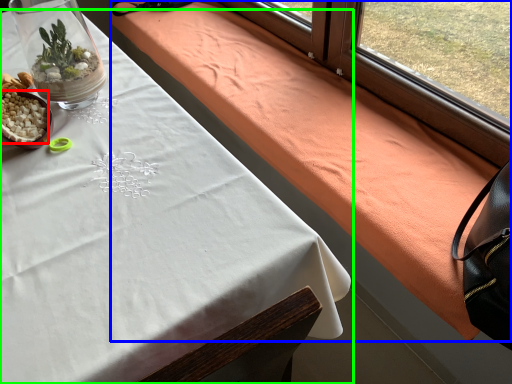
Question: Which object is positioned farthest from food (highlighted by a red box)? Select from blanket (highlighted by a blue box) and table (highlighted by a green box).

Choices:
 (A) blanket
 (B) table

Answer: (A)